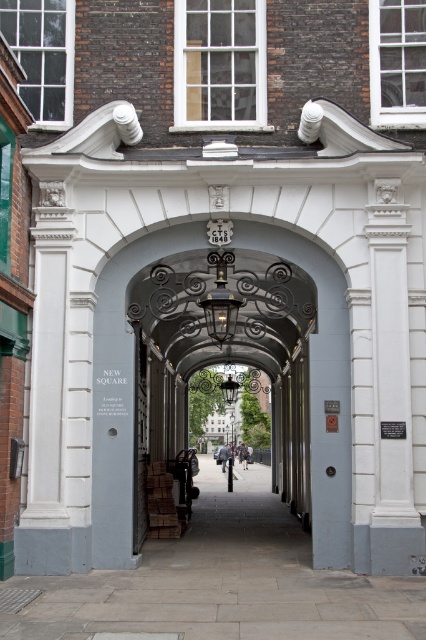
Can you confirm if smooth stone alley at center is shorter than white stone pillar at left?

No, smooth stone alley at center is not shorter than white stone pillar at left.

Does smooth stone alley at center appear under white stone pillar at left?

Indeed, smooth stone alley at center is positioned under white stone pillar at left.

Does point (106, 600) come farther from viewer compared to point (37, 307)?

No, it is not.

You are a GUI agent. You are given a task and a screenshot of the screen. Output one action in this format:
    pyautogui.click(x=<x>, y=<y>)
    Task: Click on the smooth stone alley at center
    This screenshot has height=640, width=426.
    Given the screenshot: What is the action you would take?
    pyautogui.click(x=222, y=582)

Does smooth gray archway at center appear on the left side of white stone pillar at left?

No, smooth gray archway at center is not to the left of white stone pillar at left.

From the picture: Is smooth gray archway at center shorter than white stone pillar at left?

No.

Describe the element at coordinates (121, 390) in the screenshot. I see `smooth gray archway at center` at that location.

The height and width of the screenshot is (640, 426). In order to click on smooth gray archway at center in this screenshot , I will do `click(121, 390)`.

Based on the photo, does smooth stone alley at center have a lesser height compared to smooth gray archway at center?

Indeed, smooth stone alley at center has a lesser height compared to smooth gray archway at center.

In the scene shown: Is smooth stone alley at center in front of smooth gray archway at center?

Yes, smooth stone alley at center is in front of smooth gray archway at center.

This screenshot has width=426, height=640. Describe the element at coordinates (222, 582) in the screenshot. I see `smooth stone alley at center` at that location.

Identify the location of smooth stone alley at center. Image resolution: width=426 pixels, height=640 pixels. (222, 582).